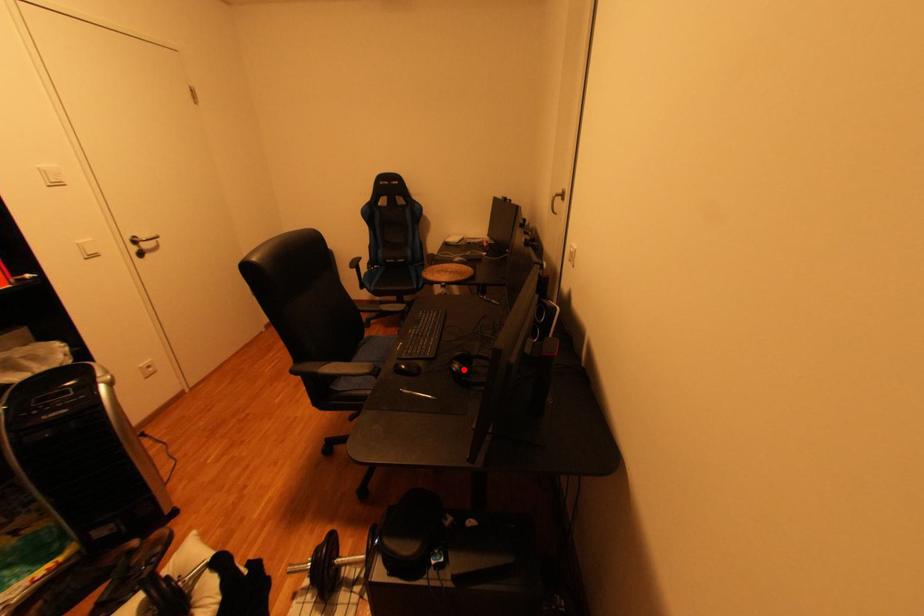
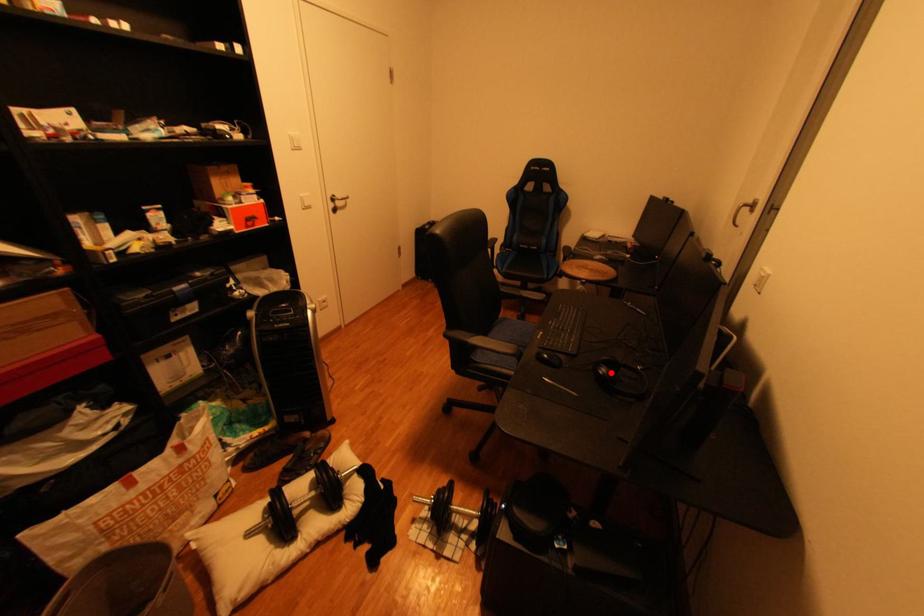
I am providing you with two images of the same scene from different viewpoints. A red point is marked on the first image and another point is marked on the second image. Is the red point in image1 aligned with the point shown in image2?

Yes